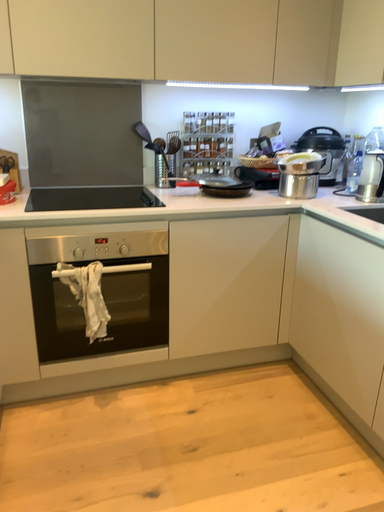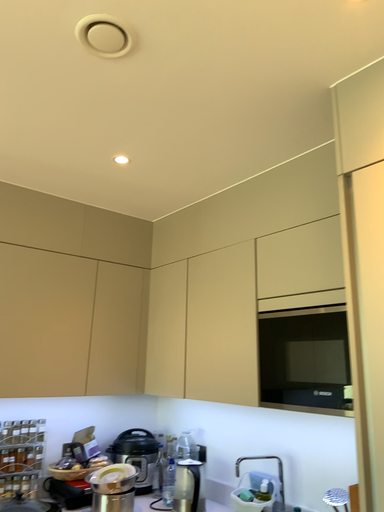
Question: How did the camera likely rotate when shooting the video?

Choices:
 (A) rotated upward
 (B) rotated downward

Answer: (A)